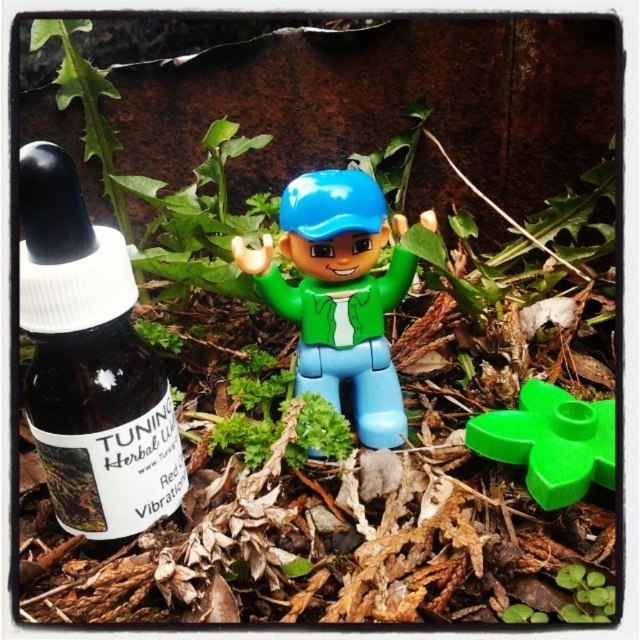
Question: Among these points, which one is nearest to the camera?

Choices:
 (A) (125, 436)
 (B) (298, 284)

Answer: (A)

Question: Can you confirm if matte plastic toy at center is wider than green plastic flower at center?

Choices:
 (A) no
 (B) yes

Answer: (B)

Question: Which object is closer to the camera taking this photo?

Choices:
 (A) transparent glass bottle at left
 (B) green plastic flower at center

Answer: (A)

Question: Can you confirm if matte plastic toy at center is positioned to the right of green plastic flower at center?

Choices:
 (A) no
 (B) yes

Answer: (A)

Question: Is transparent glass bottle at left above matte plastic toy at center?

Choices:
 (A) no
 (B) yes

Answer: (A)

Question: Based on their relative distances, which object is farther from the matte plastic toy at center?

Choices:
 (A) green plastic flower at center
 (B) transparent glass bottle at left

Answer: (B)